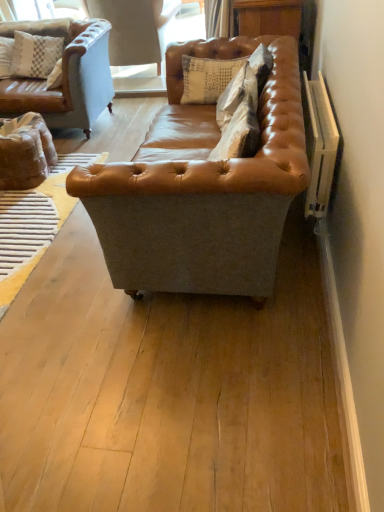
Find the location of a particular element. light blue leather swivel chair at upper left is located at coordinates (135, 29).

Locate an element on the screen. The height and width of the screenshot is (512, 384). suede textured pillow at center, marked as the first pillow in a bottom-to-top arrangement is located at coordinates (237, 94).

Is saddle brown leather couch at center inside the boundaries of light blue leather swivel chair at upper left, or outside?

saddle brown leather couch at center is located beyond the bounds of light blue leather swivel chair at upper left.

From the image's perspective, does saddle brown leather couch at center appear higher than light blue leather swivel chair at upper left?

No, from the image's perspective, saddle brown leather couch at center is not over light blue leather swivel chair at upper left.

Is saddle brown leather couch at center shorter than light blue leather swivel chair at upper left?

No, saddle brown leather couch at center is not shorter than light blue leather swivel chair at upper left.

Could leather/cushion at center, which appears as the first pillow when viewed from the top, be considered to be inside saddle brown leather couch at center?

Yes, saddle brown leather couch at center is surrounding leather/cushion at center, which appears as the first pillow when viewed from the top.

Based on their sizes in the image, would you say saddle brown leather couch at center is bigger or smaller than leather/cushion at center, which is the second pillow in front-to-back order?

Considering their sizes, saddle brown leather couch at center takes up more space than leather/cushion at center, which is the second pillow in front-to-back order.

Considering the relative sizes of saddle brown leather couch at center and leather/cushion at center, which is the second pillow in front-to-back order, in the image provided, is saddle brown leather couch at center wider than leather/cushion at center, which is the second pillow in front-to-back order,?

Yes, saddle brown leather couch at center is wider than leather/cushion at center, which is the second pillow in front-to-back order.

Is saddle brown leather couch at center with leather/cushion at center, which is the second pillow in front-to-back order?

No, saddle brown leather couch at center is not making contact with leather/cushion at center, which is the second pillow in front-to-back order.

Considering the relative positions of suede textured pillow at center, which is the first pillow from front to back, and leather/cushion at center, which appears as the first pillow when viewed from the top, in the image provided, is suede textured pillow at center, which is the first pillow from front to back, to the left or to the right of leather/cushion at center, which appears as the first pillow when viewed from the top,?

In the image, suede textured pillow at center, which is the first pillow from front to back, appears on the right side of leather/cushion at center, which appears as the first pillow when viewed from the top.

Can you tell me how much suede textured pillow at center, marked as the first pillow in a bottom-to-top arrangement, and leather/cushion at center, which appears as the first pillow when viewed from the top, differ in facing direction?

The angular difference between suede textured pillow at center, marked as the first pillow in a bottom-to-top arrangement, and leather/cushion at center, which appears as the first pillow when viewed from the top, is 89.8 degrees.

Considering the sizes of suede textured pillow at center, the second pillow viewed from the top, and leather/cushion at center, acting as the 1th pillow starting from the back, in the image, is suede textured pillow at center, the second pillow viewed from the top, taller or shorter than leather/cushion at center, acting as the 1th pillow starting from the back,?

Considering their sizes, suede textured pillow at center, the second pillow viewed from the top, has less height than leather/cushion at center, acting as the 1th pillow starting from the back.

Is suede textured pillow at center, the second pillow viewed from the top, not near leather/cushion at center, which appears as the first pillow when viewed from the top?

No, suede textured pillow at center, the second pillow viewed from the top, is not far away from leather/cushion at center, which appears as the first pillow when viewed from the top.

Is saddle brown leather couch at center spatially inside suede textured pillow at center, the second pillow viewed from the top, or outside of it?

saddle brown leather couch at center is not enclosed by suede textured pillow at center, the second pillow viewed from the top.

Is the position of saddle brown leather couch at center more distant than that of suede textured pillow at center, arranged as the second pillow when viewed from the back?

No, saddle brown leather couch at center is in front of suede textured pillow at center, arranged as the second pillow when viewed from the back.

The height and width of the screenshot is (512, 384). In order to click on the 1st pillow above the saddle brown leather couch at center (from the image's perspective) in this screenshot , I will do 237,94.

What's the angular difference between saddle brown leather couch at center and suede textured pillow at center, which is the first pillow from front to back,'s facing directions?

1.55 degrees separate the facing orientations of saddle brown leather couch at center and suede textured pillow at center, which is the first pillow from front to back.

Is light blue leather swivel chair at upper left taller or shorter than leather/cushion at center, which ranks as the 2th pillow in bottom-to-top order?

Considering their sizes, light blue leather swivel chair at upper left has more height than leather/cushion at center, which ranks as the 2th pillow in bottom-to-top order.

From a real-world perspective, is light blue leather swivel chair at upper left positioned over leather/cushion at center, which appears as the first pillow when viewed from the top, based on gravity?

No, from a real-world perspective, light blue leather swivel chair at upper left is not over leather/cushion at center, which appears as the first pillow when viewed from the top

Considering the positions of points (175, 3) and (235, 63), is point (175, 3) closer to camera compared to point (235, 63)?

No, (175, 3) is behind (235, 63).

Between light blue leather swivel chair at upper left and leather/cushion at center, which ranks as the 2th pillow in bottom-to-top order, which one is positioned behind?

light blue leather swivel chair at upper left is behind.

Based on the photo, considering the relative positions of suede textured pillow at center, which is the first pillow from front to back, and light blue leather swivel chair at upper left in the image provided, is suede textured pillow at center, which is the first pillow from front to back, to the left of light blue leather swivel chair at upper left from the viewer's perspective?

Incorrect, suede textured pillow at center, which is the first pillow from front to back, is not on the left side of light blue leather swivel chair at upper left.

Is light blue leather swivel chair at upper left at the back of suede textured pillow at center, the second pillow viewed from the top?

No, suede textured pillow at center, the second pillow viewed from the top,'s orientation is not away from light blue leather swivel chair at upper left.

How many degrees apart are the facing directions of suede textured pillow at center, marked as the first pillow in a bottom-to-top arrangement, and light blue leather swivel chair at upper left?

87.6 degrees separate the facing orientations of suede textured pillow at center, marked as the first pillow in a bottom-to-top arrangement, and light blue leather swivel chair at upper left.

From the image's perspective, is light blue leather swivel chair at upper left on top of suede textured pillow at center, which is the first pillow from front to back?

Yes, from the image's perspective, light blue leather swivel chair at upper left is above suede textured pillow at center, which is the first pillow from front to back.

Is light blue leather swivel chair at upper left in front of or behind suede textured pillow at center, the second pillow viewed from the top, in the image?

light blue leather swivel chair at upper left is positioned farther from the viewer than suede textured pillow at center, the second pillow viewed from the top.

How different are the orientations of light blue leather swivel chair at upper left and suede textured pillow at center, the second pillow viewed from the top, in degrees?

The facing directions of light blue leather swivel chair at upper left and suede textured pillow at center, the second pillow viewed from the top, are 87.6 degrees apart.

Could you measure the distance between light blue leather swivel chair at upper left and suede textured pillow at center, arranged as the second pillow when viewed from the back?

A distance of 2.17 meters exists between light blue leather swivel chair at upper left and suede textured pillow at center, arranged as the second pillow when viewed from the back.

At what (x,y) coordinates should I click in order to perform the action: click on swivel chair above the saddle brown leather couch at center (from a real-world perspective). Please return your answer as a coordinate pair (x, y). This screenshot has height=512, width=384. Looking at the image, I should click on (135, 29).

At what (x,y) coordinates should I click in order to perform the action: click on studio couch on the left of leather/cushion at center, which is the second pillow in front-to-back order. Please return your answer as a coordinate pair (x, y). The image size is (384, 512). Looking at the image, I should click on (202, 188).

Estimate the real-world distances between objects in this image. Which object is further from saddle brown leather couch at center, suede textured pillow at center, arranged as the second pillow when viewed from the back, or leather/cushion at center, which appears as the first pillow when viewed from the top?

leather/cushion at center, which appears as the first pillow when viewed from the top.

Estimate the real-world distances between objects in this image. Which object is further from suede textured pillow at center, the second pillow viewed from the top, light blue leather swivel chair at upper left or saddle brown leather couch at center?

Among the two, light blue leather swivel chair at upper left is located further to suede textured pillow at center, the second pillow viewed from the top.

When comparing their distances from saddle brown leather couch at center, does light blue leather swivel chair at upper left or leather/cushion at center, acting as the 1th pillow starting from the back, seem further?

light blue leather swivel chair at upper left is further to saddle brown leather couch at center.

Considering their positions, is suede textured pillow at center, arranged as the second pillow when viewed from the back, positioned further to leather/cushion at center, which is the second pillow in front-to-back order, than saddle brown leather couch at center?

Among the two, saddle brown leather couch at center is located further to leather/cushion at center, which is the second pillow in front-to-back order.

When comparing their distances from light blue leather swivel chair at upper left, does leather/cushion at center, acting as the 1th pillow starting from the back, or suede textured pillow at center, which is the first pillow from front to back, seem closer?

leather/cushion at center, acting as the 1th pillow starting from the back, lies closer to light blue leather swivel chair at upper left than the other object.

Estimate the real-world distances between objects in this image. Which object is further from saddle brown leather couch at center, suede textured pillow at center, marked as the first pillow in a bottom-to-top arrangement, or light blue leather swivel chair at upper left?

The object further to saddle brown leather couch at center is light blue leather swivel chair at upper left.

Estimate the real-world distances between objects in this image. Which object is further from suede textured pillow at center, arranged as the second pillow when viewed from the back, saddle brown leather couch at center or leather/cushion at center, which is the second pillow in front-to-back order?

Based on the image, saddle brown leather couch at center appears to be further to suede textured pillow at center, arranged as the second pillow when viewed from the back.

Looking at the image, which one is located closer to light blue leather swivel chair at upper left, leather/cushion at center, acting as the 1th pillow starting from the back, or saddle brown leather couch at center?

leather/cushion at center, acting as the 1th pillow starting from the back, lies closer to light blue leather swivel chair at upper left than the other object.

The image size is (384, 512). I want to click on pillow between suede textured pillow at center, marked as the first pillow in a bottom-to-top arrangement, and light blue leather swivel chair at upper left, along the z-axis, so point(207,78).

Identify the location of pillow between saddle brown leather couch at center and leather/cushion at center, which is the second pillow in front-to-back order, from front to back. This screenshot has height=512, width=384. (237, 94).